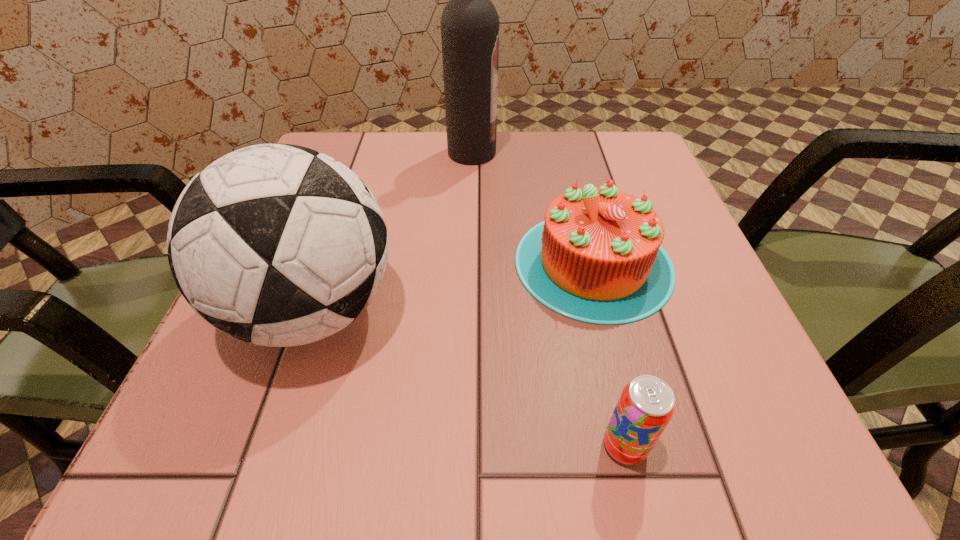
Locate an element on the screen. the third closest object relative to the cake is located at coordinates (276, 244).

You are a GUI agent. You are given a task and a screenshot of the screen. Output one action in this format:
    pyautogui.click(x=<x>, y=<y>)
    Task: Click on the vacant region that satisfies the following two spatial constraints: 1. on the surface of the third shortest object where the brand logo is visible; 2. on the left side of the nearest object
    This screenshot has width=960, height=540.
    Given the screenshot: What is the action you would take?
    coord(268,446)

At what (x,y) coordinates should I click in order to perform the action: click on free space that satisfies the following two spatial constraints: 1. on the surface of the soda can where the brand logo is visible; 2. on the left side of the third shortest object. Please return your answer as a coordinate pair (x, y). This screenshot has width=960, height=540. Looking at the image, I should click on (268, 446).

Image resolution: width=960 pixels, height=540 pixels. In order to click on free spot that satisfies the following two spatial constraints: 1. on the label of the tallest object; 2. on the left side of the third tallest object in this screenshot , I will do `click(469, 263)`.

Image resolution: width=960 pixels, height=540 pixels. Find the location of `vacant region that satisfies the following two spatial constraints: 1. on the back side of the soda can; 2. on the label of the farthest object`. vacant region that satisfies the following two spatial constraints: 1. on the back side of the soda can; 2. on the label of the farthest object is located at coordinates (557, 153).

What are the coordinates of `free spot that satisfies the following two spatial constraints: 1. on the surface of the second tallest object where the brand logo is visible; 2. on the right side of the soda can` in the screenshot? It's located at (268, 446).

At what (x,y) coordinates should I click in order to perform the action: click on free space that satisfies the following two spatial constraints: 1. on the front side of the cake; 2. on the surface of the soccer ball where the brand logo is visible. Please return your answer as a coordinate pair (x, y). This screenshot has height=540, width=960. Looking at the image, I should click on (606, 310).

Identify the location of free space that satisfies the following two spatial constraints: 1. on the label of the third object from right to left; 2. on the back side of the nearest object. [465, 446].

At what (x,y) coordinates should I click in order to perform the action: click on blank area in the image that satisfies the following two spatial constraints: 1. on the label of the farthest object; 2. on the left side of the nearest object. Please return your answer as a coordinate pair (x, y). This screenshot has height=540, width=960. Looking at the image, I should click on (465, 446).